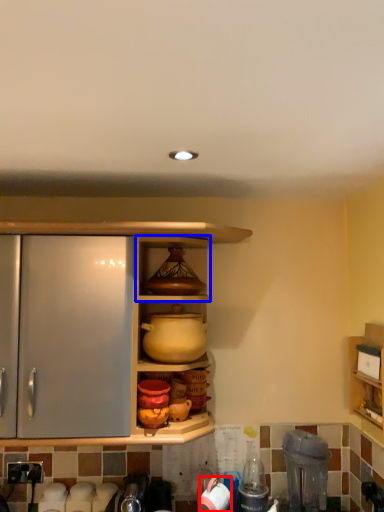
Question: Which object appears farthest to the camera in this image, appliance (highlighted by a red box) or cabinet (highlighted by a blue box)?

Choices:
 (A) appliance
 (B) cabinet

Answer: (A)